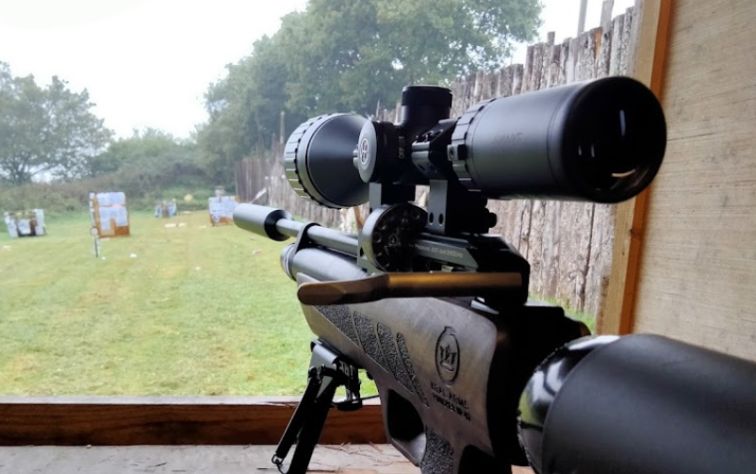
I want to click on wood frame, so click(x=150, y=419).